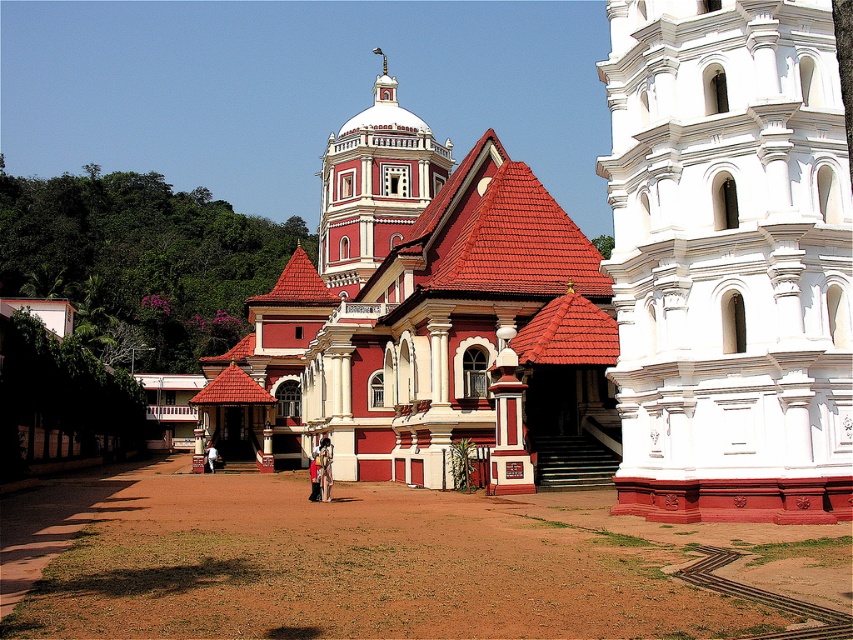
Who is more distant from viewer, (618, 476) or (376, 138)?

Point (376, 138)

Can you confirm if white stone tower at right is thinner than red painted dome at center?

Indeed, white stone tower at right has a lesser width compared to red painted dome at center.

What do you see at coordinates (729, 260) in the screenshot? The width and height of the screenshot is (853, 640). I see `white stone tower at right` at bounding box center [729, 260].

In order to click on white stone tower at right in this screenshot , I will do `click(729, 260)`.

Consider the image. Between red fabric person at center and dark blue fabric at center, which one has more height?

Standing taller between the two is red fabric person at center.

Find the location of a particular element. red fabric person at center is located at coordinates (314, 476).

Does point (312, 464) lie behind point (218, 452)?

No, (312, 464) is closer to viewer.

Where is `red fabric person at center`? red fabric person at center is located at coordinates tap(314, 476).

Between red painted dome at center and red fabric person at center, which one appears on the right side from the viewer's perspective?

Positioned to the right is red fabric person at center.

Who is more forward, (367, 124) or (316, 454)?

Point (316, 454) is more forward.

Locate an element on the screen. The image size is (853, 640). red painted dome at center is located at coordinates (374, 186).